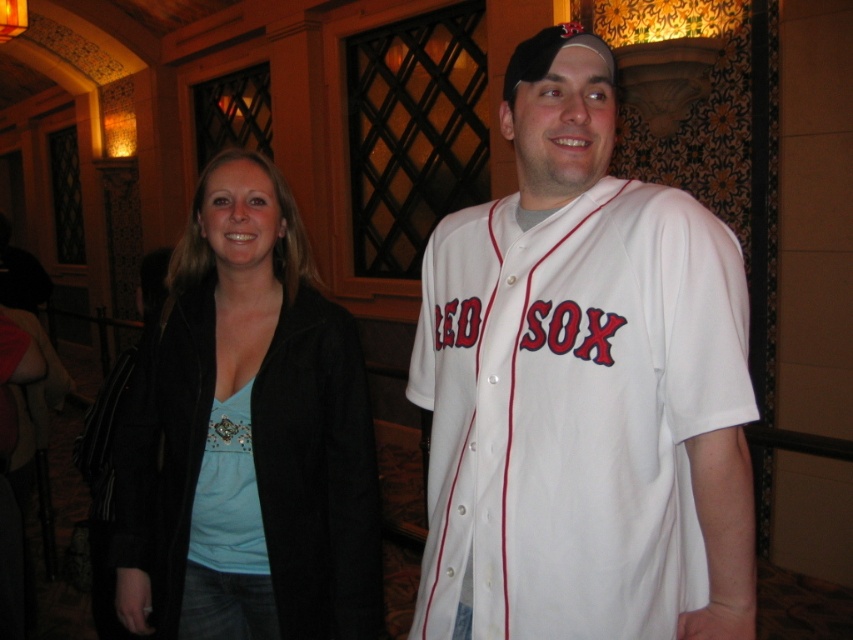
Question: Observing the image, what is the correct spatial positioning of white jersey at center in reference to matte black jacket at center?

Choices:
 (A) below
 (B) above

Answer: (B)

Question: Can you confirm if white jersey at center is wider than matte black jacket at center?

Choices:
 (A) yes
 (B) no

Answer: (B)

Question: Which point is farther to the camera?

Choices:
 (A) (556, 164)
 (B) (358, 586)

Answer: (B)

Question: Can you confirm if white jersey at center is smaller than matte black jacket at center?

Choices:
 (A) no
 (B) yes

Answer: (B)

Question: Among these points, which one is farthest from the camera?

Choices:
 (A) (643, 496)
 (B) (347, 618)

Answer: (B)